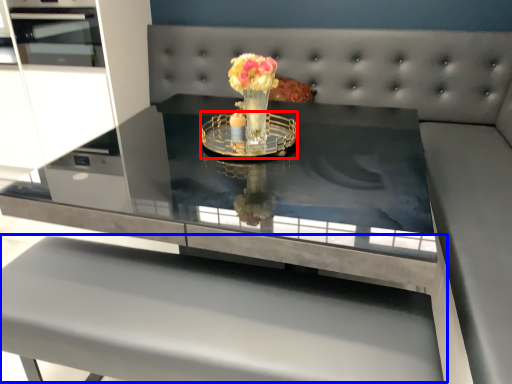
Question: Among these objects, which one is farthest to the camera, glass plate (highlighted by a red box) or table (highlighted by a blue box)?

Choices:
 (A) glass plate
 (B) table

Answer: (A)